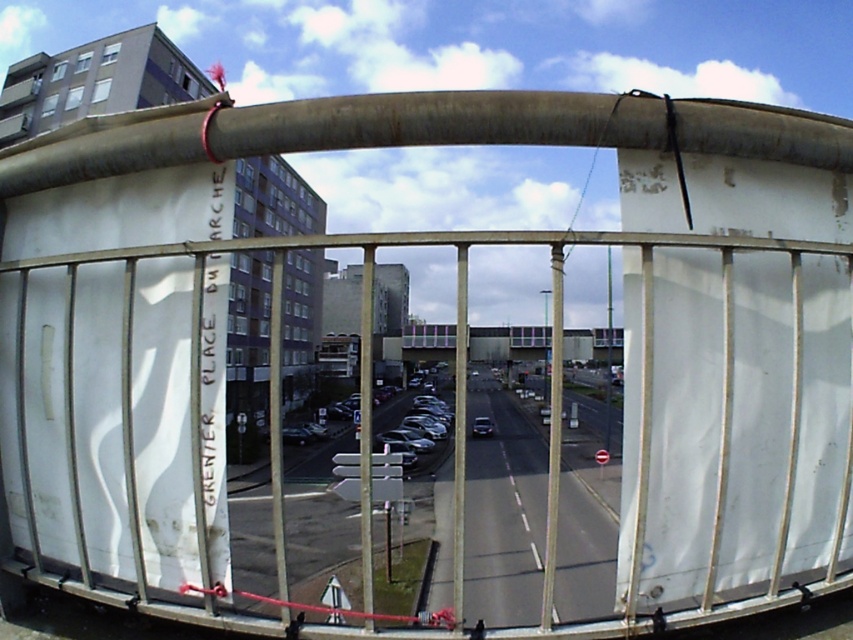
Does concrete bridge at center appear on the left side of shiny black car at center?

In fact, concrete bridge at center is to the right of shiny black car at center.

Does concrete bridge at center appear under shiny black car at center?

Actually, concrete bridge at center is above shiny black car at center.

Between point (549, 333) and point (480, 426), which one is positioned behind?

The point (549, 333) is behind.

Locate an element on the screen. The image size is (853, 640). concrete bridge at center is located at coordinates (508, 342).